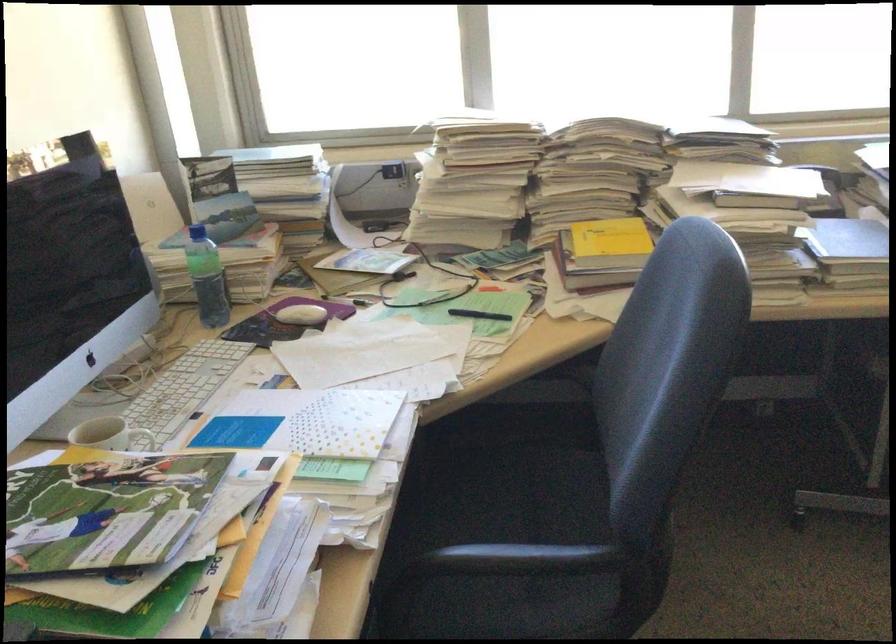
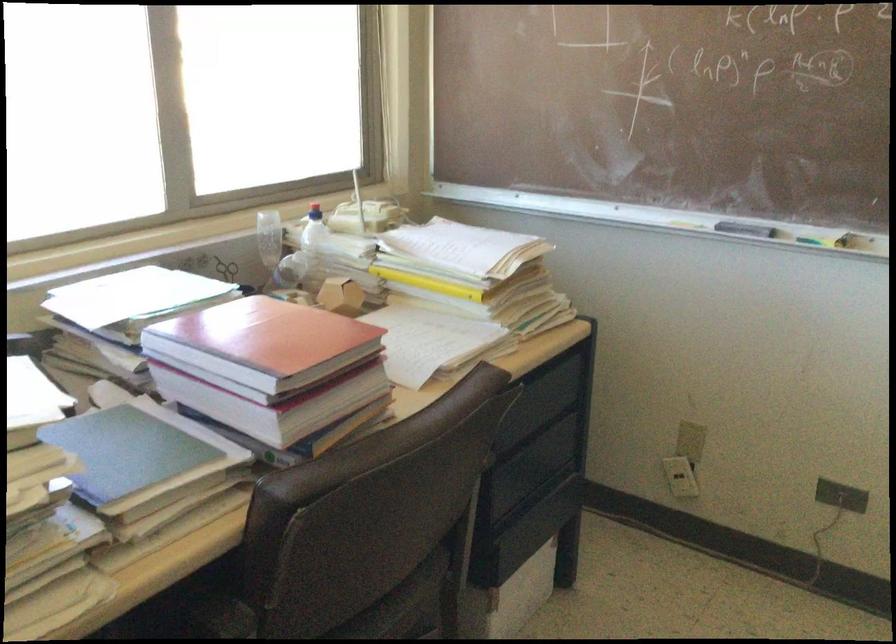
Question: The first image is from the beginning of the video and the second image is from the end. How did the camera likely rotate when shooting the video?

Choices:
 (A) Left
 (B) Right
 (C) Up
 (D) Down

Answer: (B)